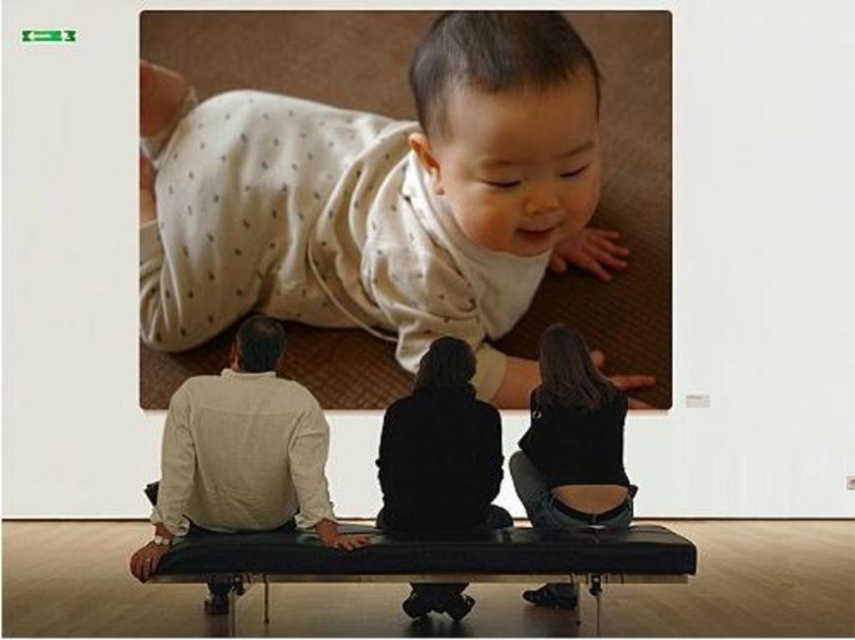
From the picture: Between black leather bench at center and denim jeans at lower right, which one is positioned lower?

black leather bench at center

Is point (675, 566) closer to camera compared to point (620, 483)?

Yes.

This screenshot has height=640, width=855. Describe the element at coordinates (435, 560) in the screenshot. I see `black leather bench at center` at that location.

What are the coordinates of `black leather bench at center` in the screenshot? It's located at (435, 560).

Who is shorter, light beige dotted fabric at upper center or denim jeans at lower right?

With less height is denim jeans at lower right.

Is light beige dotted fabric at upper center positioned before denim jeans at lower right?

That is False.

Find the location of `light beige dotted fabric at upper center`. light beige dotted fabric at upper center is located at coordinates (380, 198).

Is light beige dotted fabric at upper center to the left of black leather bench at center from the viewer's perspective?

Correct, you'll find light beige dotted fabric at upper center to the left of black leather bench at center.

In order to click on light beige dotted fabric at upper center in this screenshot , I will do `click(380, 198)`.